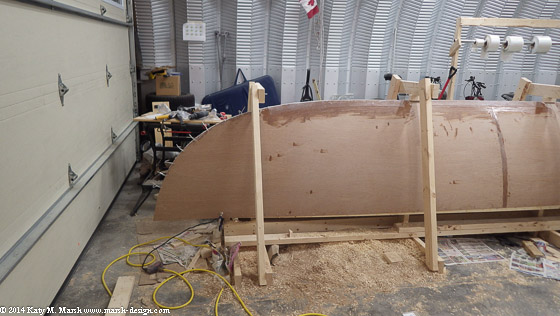
You are a GUI agent. You are given a task and a screenshot of the screen. Output one action in this format:
    pyautogui.click(x=<x>, y=<y>)
    Task: Click on the cardboard box
    
    Given the screenshot: What is the action you would take?
    pyautogui.click(x=174, y=83)